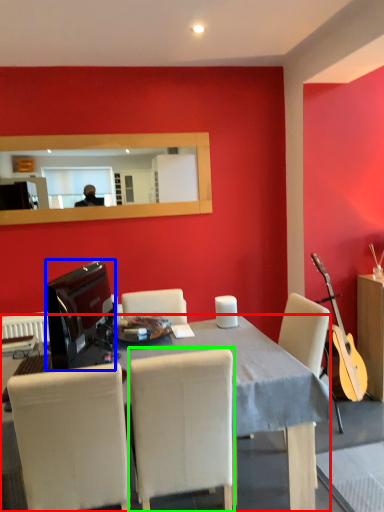
Question: Which is nearer to the desk (highlighted by a red box)? television (highlighted by a blue box) or chair (highlighted by a green box).

Choices:
 (A) television
 (B) chair

Answer: (B)